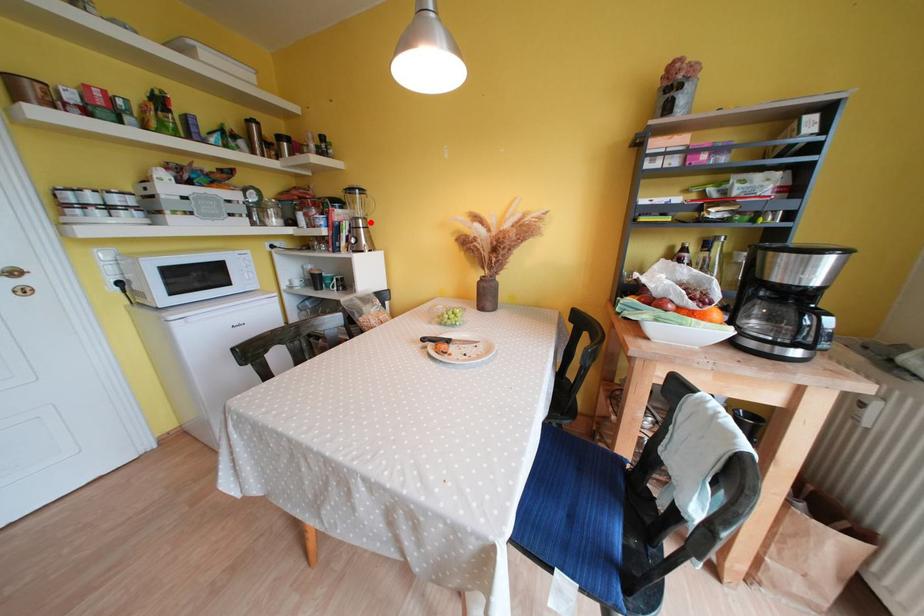
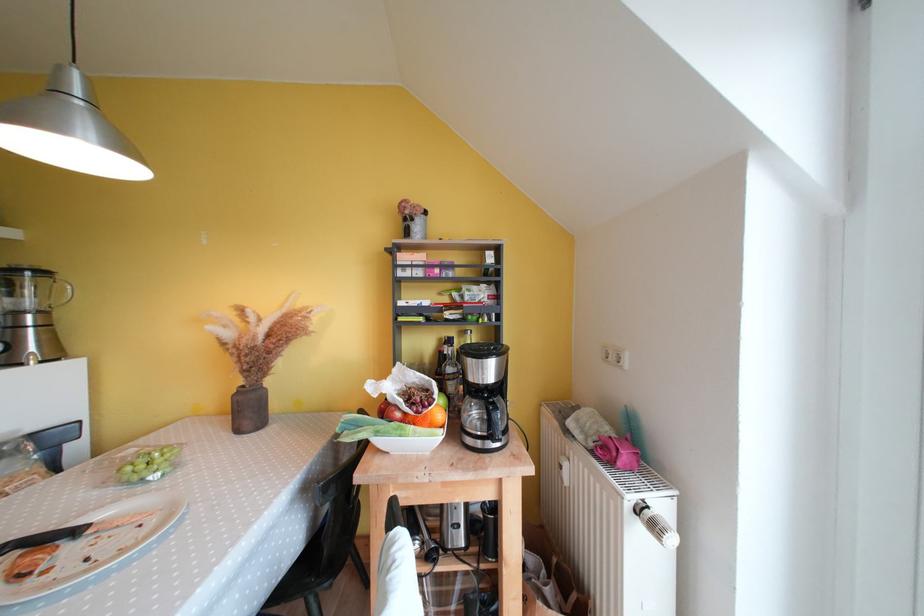
Question: A red point is marked in image1. In image2, is the corresponding 3D point closer to the camera or farther? Reply with the corresponding letter.

Choices:
 (A) The corresponding 3D point is closer.
 (B) The corresponding 3D point is farther.

Answer: (B)